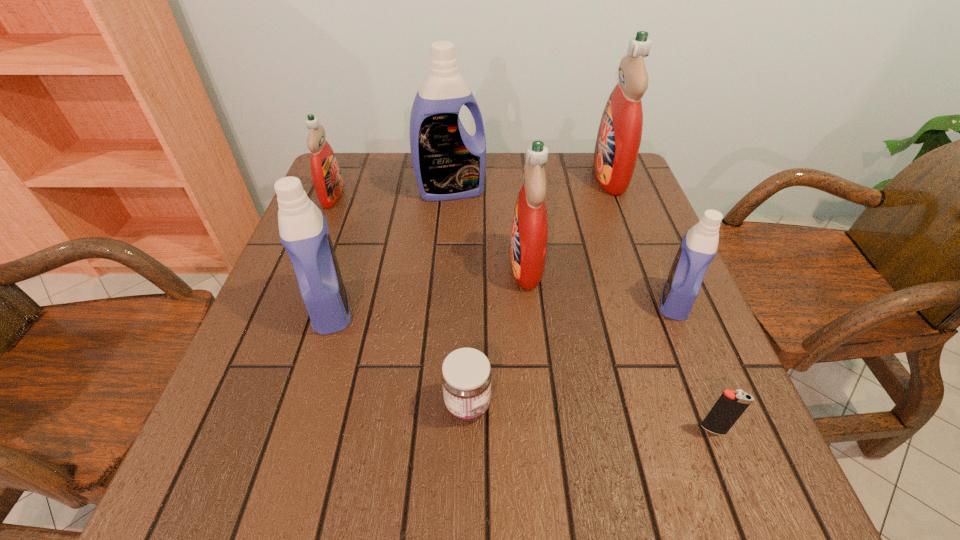
Where is `vacant space located 0.070m on the front surface of the leftmost detergent`? This screenshot has width=960, height=540. vacant space located 0.070m on the front surface of the leftmost detergent is located at coordinates (369, 196).

The image size is (960, 540). What are the coordinates of `free location located 0.230m on the left of the smallest blue detergent` in the screenshot? It's located at (544, 301).

Where is `blank space located on the front label of the jam`? blank space located on the front label of the jam is located at coordinates coord(591,404).

Identify the location of free region located 0.320m on the back of the igniter. (656, 284).

Image resolution: width=960 pixels, height=540 pixels. What are the coordinates of `igniter that is at the right edge` in the screenshot? It's located at (729, 407).

Find the location of a particular element. The height and width of the screenshot is (540, 960). object situated at the far left corner is located at coordinates (325, 171).

This screenshot has width=960, height=540. I want to click on object at the far right corner, so click(x=619, y=136).

At what (x,y) coordinates should I click in order to perform the action: click on vacant space at the far edge. Please return your answer as a coordinate pair (x, y). Looking at the image, I should click on (578, 183).

Where is `vacant region at the near edge of the desktop`? The height and width of the screenshot is (540, 960). vacant region at the near edge of the desktop is located at coordinates (388, 483).

In the image, there is a desktop. Where is `vacant area at the right edge`? The height and width of the screenshot is (540, 960). vacant area at the right edge is located at coordinates (636, 325).